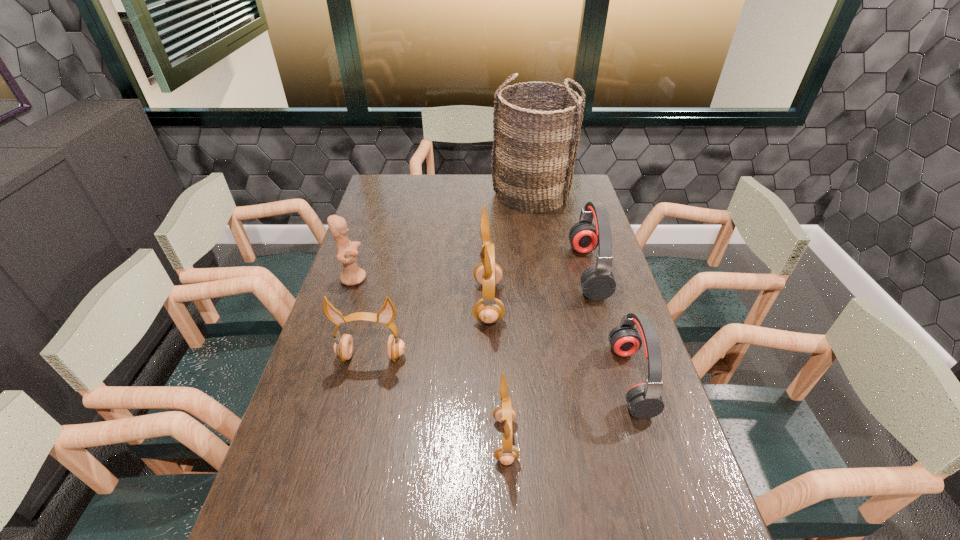
Find the location of a particular element. Image resolution: width=960 pixels, height=540 pixels. the tallest object is located at coordinates (536, 137).

Locate an element on the screen. basket is located at coordinates [536, 137].

At what (x,y) coordinates should I click in order to perform the action: click on the farthest brown earphone. Please return your answer as a coordinate pair (x, y). Image resolution: width=960 pixels, height=540 pixels. Looking at the image, I should click on (489, 309).

You are a GUI agent. You are given a task and a screenshot of the screen. Output one action in this format:
    pyautogui.click(x=<x>, y=<y>)
    Task: Click on the biggest brown earphone
    The width and height of the screenshot is (960, 540).
    Given the screenshot: What is the action you would take?
    pyautogui.click(x=489, y=309)

You are a GUI agent. You are given a task and a screenshot of the screen. Output one action in this format:
    pyautogui.click(x=<x>, y=<y>)
    Task: Click on the bigger red earphone
    This screenshot has width=960, height=540.
    Given the screenshot: What is the action you would take?
    pyautogui.click(x=598, y=283)

This screenshot has width=960, height=540. I want to click on figurine, so click(347, 252).

You are a GUI agent. You are given a task and a screenshot of the screen. Output one action in this format:
    pyautogui.click(x=<x>, y=<y>)
    Task: Click on the leftmost earphone
    Image resolution: width=960 pixels, height=540 pixels.
    Given the screenshot: What is the action you would take?
    pyautogui.click(x=343, y=347)

I want to click on the second biggest brown earphone, so click(x=343, y=347).

Locate an element on the screen. Image resolution: width=960 pixels, height=540 pixels. the nearer red earphone is located at coordinates (644, 400).

Identify the location of the smallest brown earphone. (507, 453).